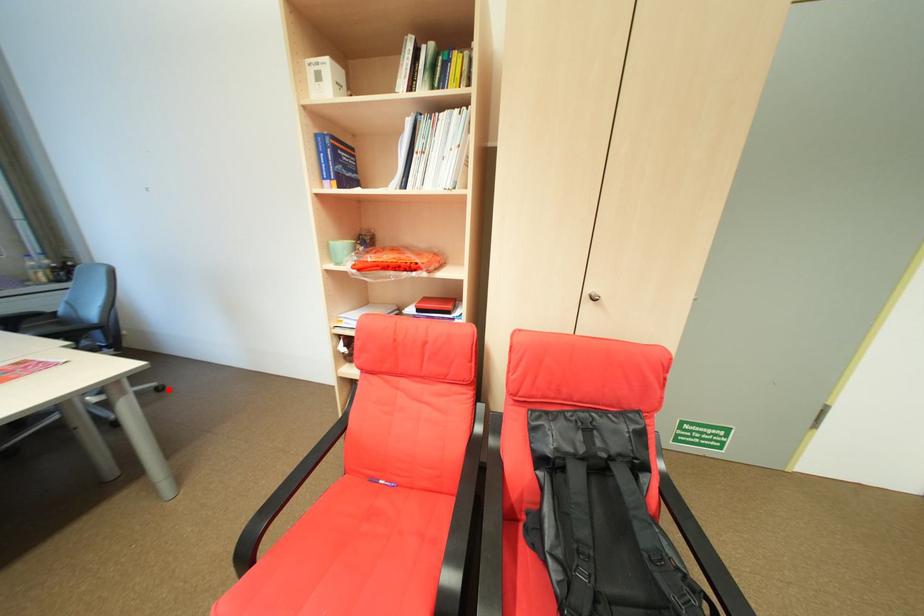
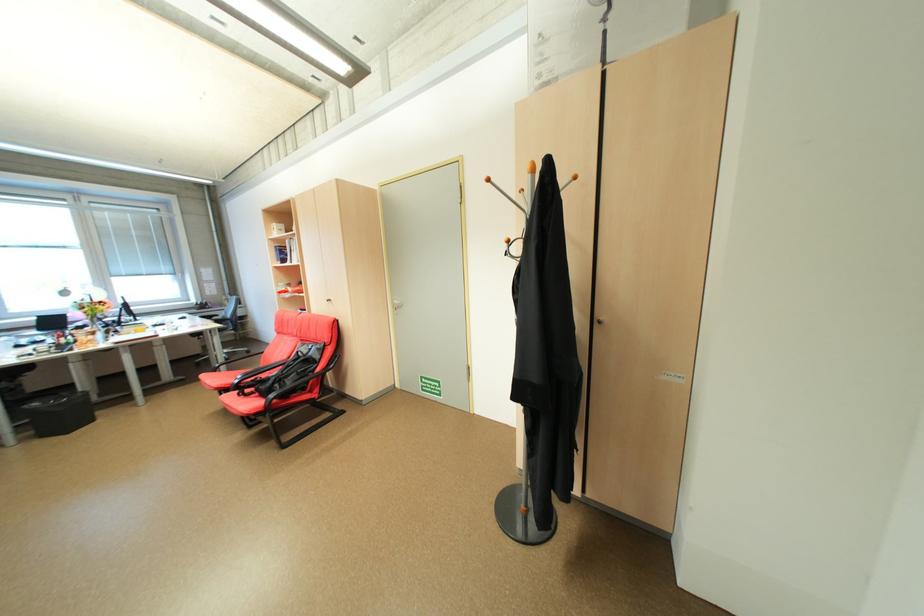
Question: I am providing you with two images of the same scene from different viewpoints. Given a red point in image1, look at the same physical point in image2. Is it:

Choices:
 (A) Closer to the viewpoint
 (B) Farther from the viewpoint

Answer: (B)